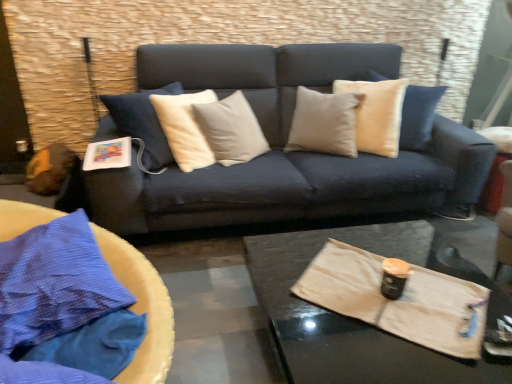
Find the location of `blank space situated above wooden tray at center (from a real-world perspective)`. blank space situated above wooden tray at center (from a real-world perspective) is located at coordinates (373, 302).